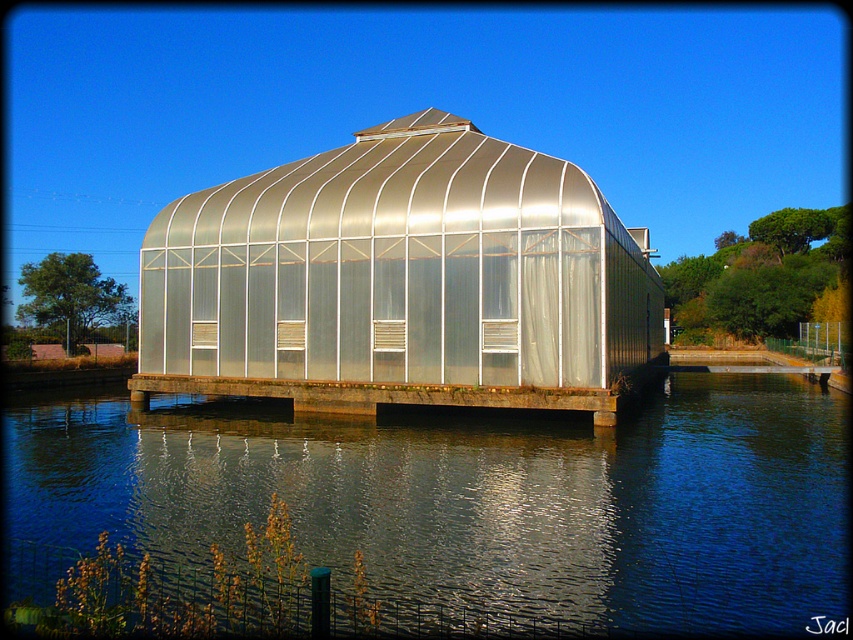
You are planning to host a small event in the transparent glass greenhouse at center and need to set up a reception area on the metallic concrete dock at center. Given the size difference between them, which location would allow for more attendees comfortably?

The transparent glass greenhouse at center is bigger than the metallic concrete dock at center, so the greenhouse can accommodate more attendees comfortably.